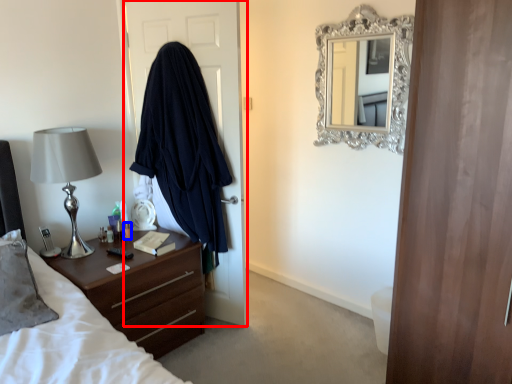
Question: Which object is further to the camera taking this photo, door (highlighted by a red box) or bottle (highlighted by a blue box)?

Choices:
 (A) door
 (B) bottle

Answer: (B)